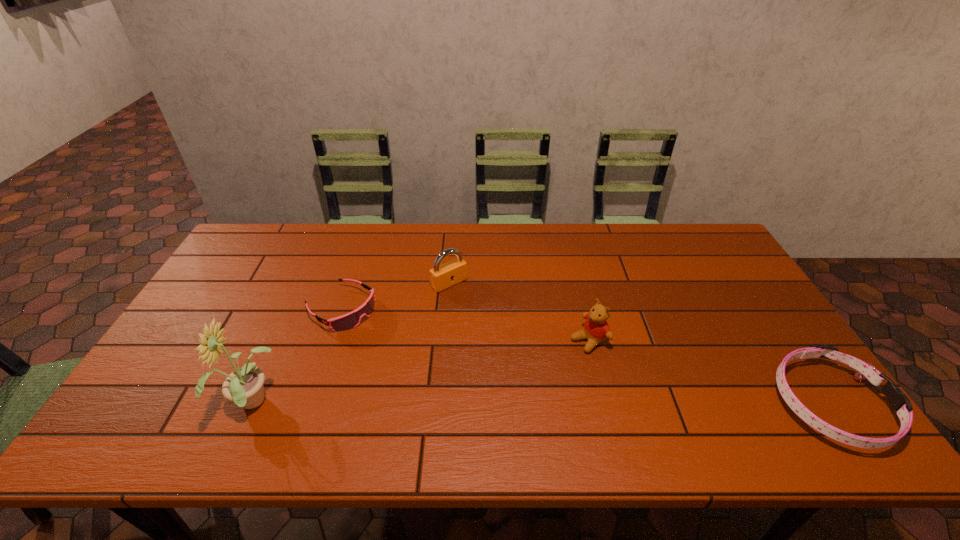
I want to click on free space located 0.290m on the front-facing side of the goggles, so click(442, 374).

You are a GUI agent. You are given a task and a screenshot of the screen. Output one action in this format:
    pyautogui.click(x=<x>, y=<y>)
    Task: Click on the vacant area situated to unlock the third object from right to left from the front
    Image resolution: width=960 pixels, height=540 pixels.
    Given the screenshot: What is the action you would take?
    click(468, 301)

The height and width of the screenshot is (540, 960). What are the coordinates of `free spot located to unlock the third object from right to left from the front` in the screenshot? It's located at (x=512, y=345).

This screenshot has width=960, height=540. Identify the location of free spot located 0.110m to unlock the third object from right to left from the front. coord(480,312).

Where is `vacant point located 0.100m on the front-facing side of the fourth object from left to right`? The image size is (960, 540). vacant point located 0.100m on the front-facing side of the fourth object from left to right is located at coordinates (546, 364).

At what (x,y) coordinates should I click in order to perform the action: click on free space located 0.250m on the front-facing side of the fourth object from left to right. Please return your answer as a coordinate pair (x, y). Image resolution: width=960 pixels, height=540 pixels. Looking at the image, I should click on (500, 392).

Find the location of a particular element. free location located 0.140m on the front-facing side of the fourth object from left to right is located at coordinates (535, 372).

The height and width of the screenshot is (540, 960). I want to click on sunflower present at the near edge, so click(x=244, y=386).

The image size is (960, 540). I want to click on dog collar located at the near edge, so click(900, 403).

Where is `object that is at the right edge`? The height and width of the screenshot is (540, 960). object that is at the right edge is located at coordinates [900, 403].